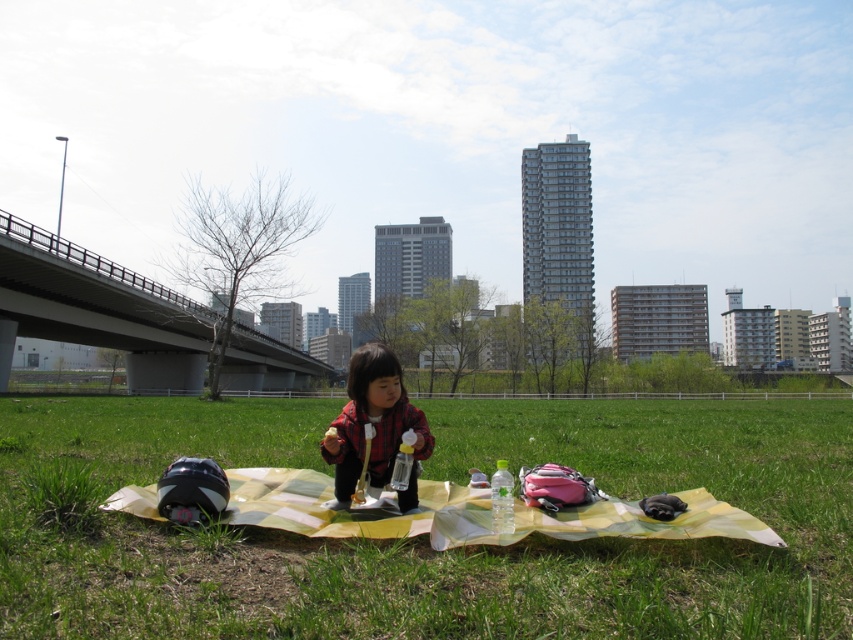
Question: Which point is farther from the camera taking this photo?

Choices:
 (A) (479, 444)
 (B) (335, 470)

Answer: (A)

Question: Is green grass at center to the right of matte red shirt at center from the viewer's perspective?

Choices:
 (A) no
 (B) yes

Answer: (B)

Question: Among these points, which one is nearest to the camera?

Choices:
 (A) (x=795, y=536)
 (B) (x=418, y=422)

Answer: (A)

Question: Is green grass at center closer to camera compared to matte red shirt at center?

Choices:
 (A) yes
 (B) no

Answer: (A)

Question: Does green grass at center appear under matte red shirt at center?

Choices:
 (A) no
 (B) yes

Answer: (B)